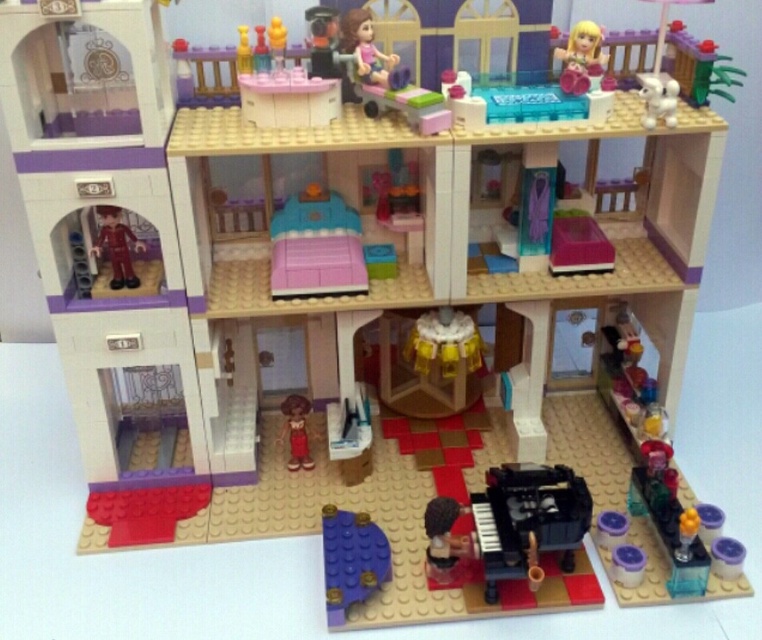
You are a visitor standing in front of the LEGO Friends house. You see the purple matte plate at lower center and the matte brown doll at center. Which object is nearer to you?

The purple matte plate at lower center is closer to the viewer than the matte brown doll at center.